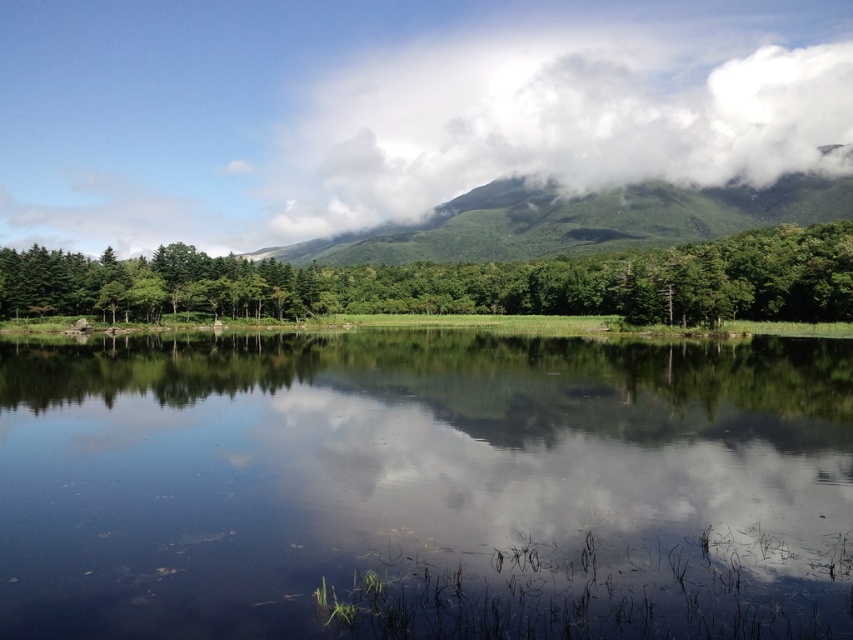
Which is behind, point (778, 118) or point (370, 237)?

Positioned behind is point (778, 118).

Does white fluffy cloud at upper center appear on the left side of green leafy mountain at upper center?

No, white fluffy cloud at upper center is not to the left of green leafy mountain at upper center.

I want to click on white fluffy cloud at upper center, so click(x=563, y=108).

Is transparent water at center to the right of green leafy tree at center from the viewer's perspective?

No, transparent water at center is not to the right of green leafy tree at center.

Does transparent water at center have a lesser height compared to green leafy tree at center?

Yes.

What do you see at coordinates (425, 488) in the screenshot? The height and width of the screenshot is (640, 853). I see `transparent water at center` at bounding box center [425, 488].

Where is `transparent water at center`? This screenshot has width=853, height=640. transparent water at center is located at coordinates (425, 488).

Who is more distant from viewer, (125, 544) or (527, 32)?

The point (527, 32) is behind.

Can you confirm if transparent water at center is positioned to the left of white fluffy cloud at upper center?

Correct, you'll find transparent water at center to the left of white fluffy cloud at upper center.

Is point (149, 616) positioned after point (630, 172)?

No, it is not.

Where is `transparent water at center`? The image size is (853, 640). transparent water at center is located at coordinates (425, 488).